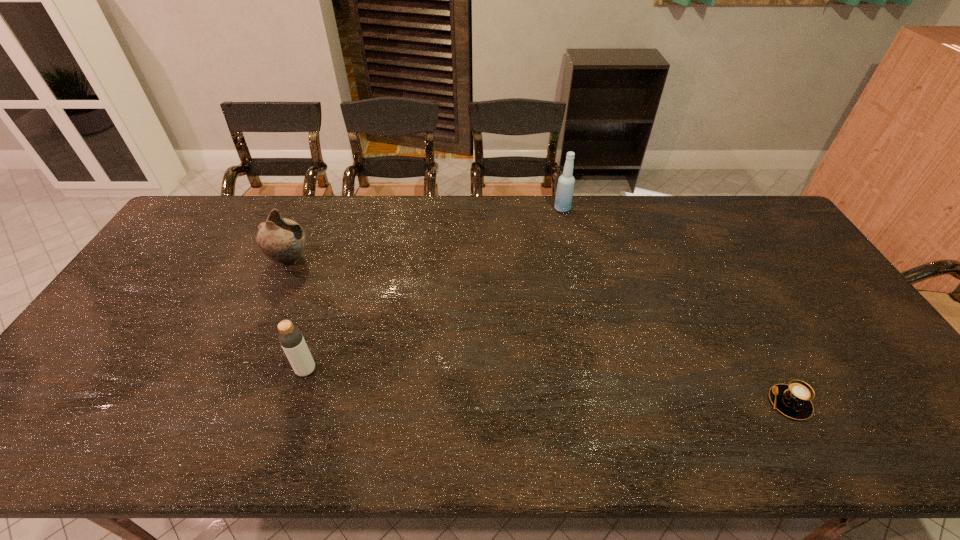
Identify the location of the right bottle. The height and width of the screenshot is (540, 960). (565, 187).

At what (x,y) coordinates should I click in order to perform the action: click on the farthest object. Please return your answer as a coordinate pair (x, y). Looking at the image, I should click on (565, 187).

Where is `the leftmost object`? The height and width of the screenshot is (540, 960). the leftmost object is located at coordinates (282, 240).

Locate an element on the screen. pottery is located at coordinates (282, 240).

The width and height of the screenshot is (960, 540). In order to click on the left bottle in this screenshot , I will do `click(290, 337)`.

Where is `the second object from left to right`? the second object from left to right is located at coordinates (290, 337).

At what (x,y) coordinates should I click in order to perform the action: click on the rightmost object. Please return your answer as a coordinate pair (x, y). This screenshot has width=960, height=540. Looking at the image, I should click on (793, 400).

This screenshot has width=960, height=540. What are the coordinates of `the nearest object` in the screenshot? It's located at (793, 400).

Where is `vacant space located on the right of the third object from left to right`? The width and height of the screenshot is (960, 540). vacant space located on the right of the third object from left to right is located at coordinates tap(668, 208).

I want to click on vacant region located 0.060m from the spout of the pottery, so click(x=330, y=260).